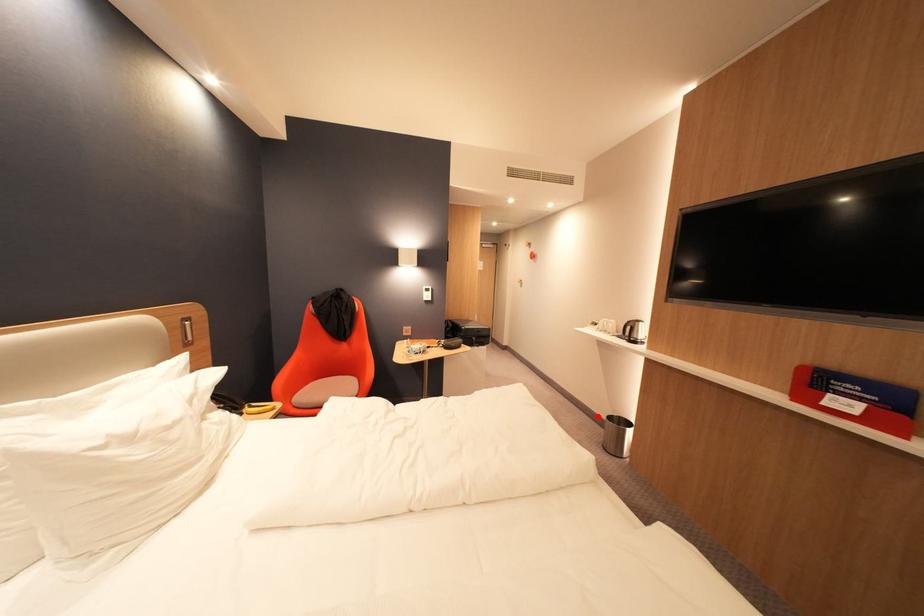
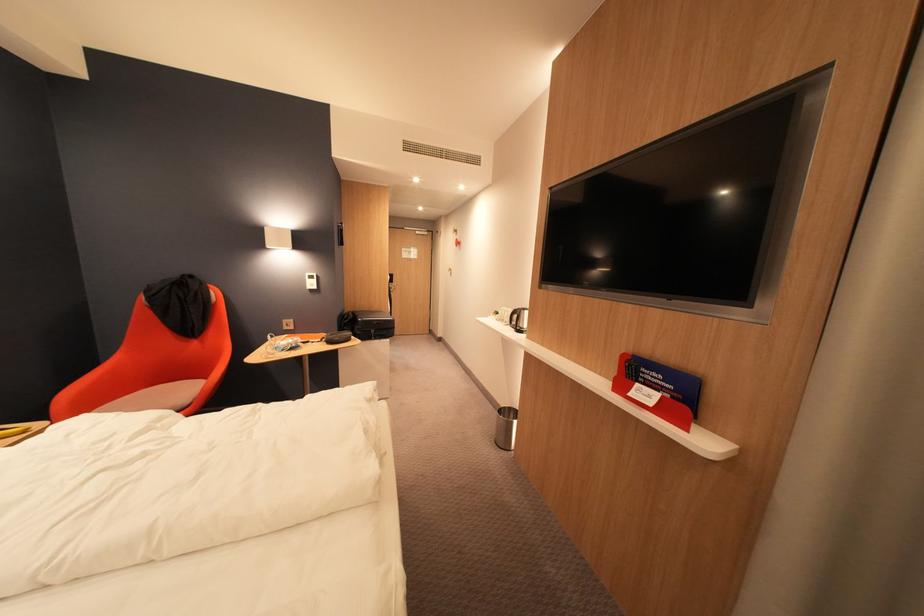
Question: I am providing you with two images of the same scene from different viewpoints. A red point is marked on the first image. Is the red point's position out of view in image 2?

Choices:
 (A) Yes
 (B) No

Answer: (B)